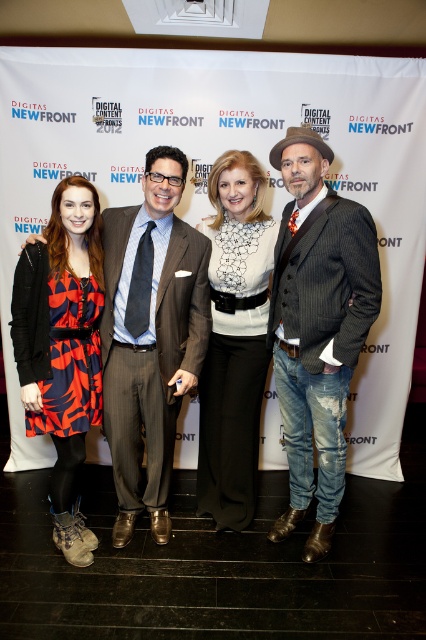
Question: Which point is farther from the camera taking this photo?

Choices:
 (A) (25, 356)
 (B) (307, 228)
 (C) (138, 260)

Answer: (C)

Question: Can you confirm if white satin blouse at center is bigger than gray pinstripe suit at center?

Choices:
 (A) yes
 (B) no

Answer: (A)

Question: Which point appears closest to the camera in this image?

Choices:
 (A) (86, 348)
 (B) (106, 268)
 (C) (310, 262)
 (D) (279, 145)

Answer: (C)

Question: Does white satin blouse at center appear over gray pinstripe suit at center?

Choices:
 (A) no
 (B) yes

Answer: (B)

Question: Is gray pinstripe suit at center below brown felt cowboy hat at upper right?

Choices:
 (A) no
 (B) yes

Answer: (B)

Question: Based on their relative distances, which object is nearer to the brown felt cowboy hat at upper right?

Choices:
 (A) distressed denim jeans at center
 (B) matte black suit at center
 (C) gray pinstripe suit at center
 (D) white satin blouse at center

Answer: (A)